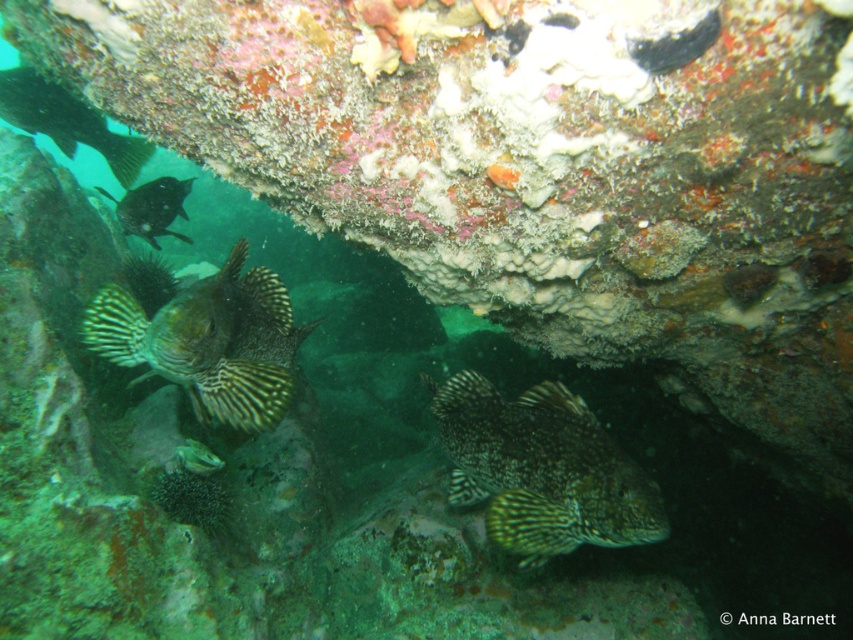
You are a scuba diver exploring the underwater reef. You notice two points in the scene, one at coordinates point (x=27, y=109) and another at point (x=137, y=230). Which point is nearer to you as you swim through the reef?

Point (x=27, y=109) is closer to the viewer than point (x=137, y=230), so the first point is nearer to you as you swim through the reef.

You are a marine biologist observing an underwater scene with a rocky reef. You notice a green striped fish at upper left and a shiny black fish at upper left. Which fish is bigger?

The green striped fish at upper left is larger in size compared to the shiny black fish at upper left.